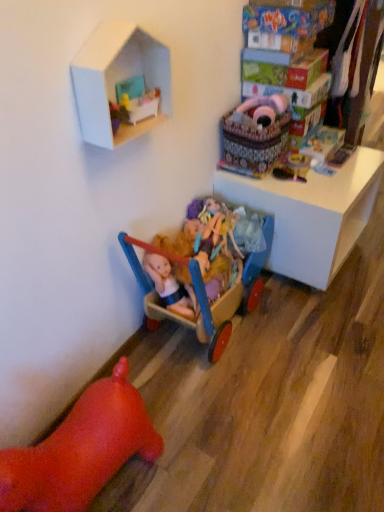
Locate an element on the screen. vacant area that lies between white glossy table at upper right and wooden wagon at lower center, which is the 5th toy in right-to-left order is located at coordinates (280, 326).